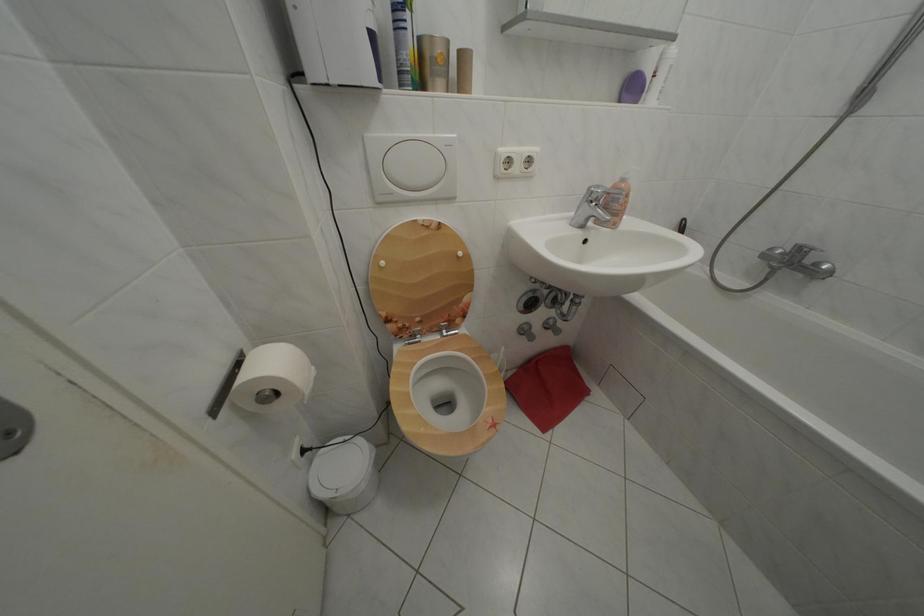
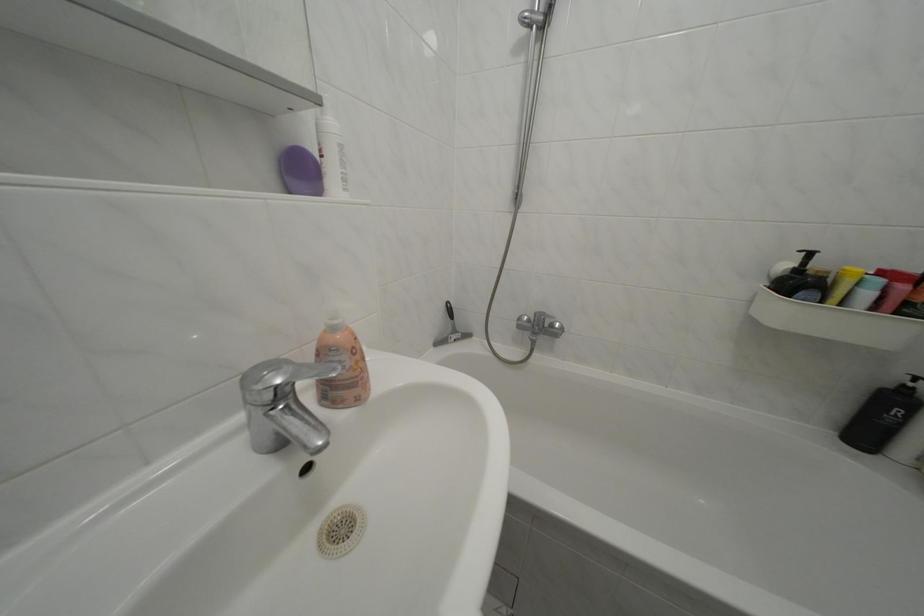
Where in the second image is the point corresponding to the point at 600,193 from the first image?

(252, 384)